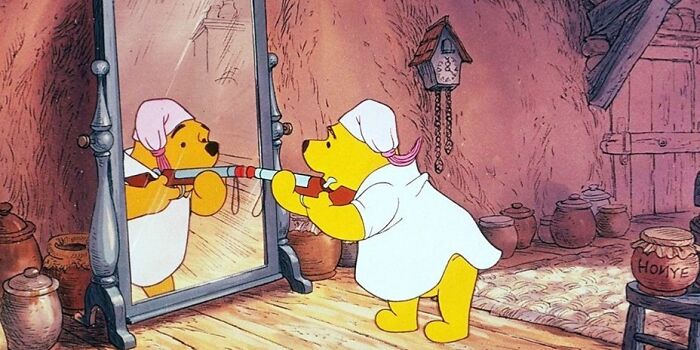
In order to click on cookoo clock on wall in this screenshot , I will do `click(447, 59)`.